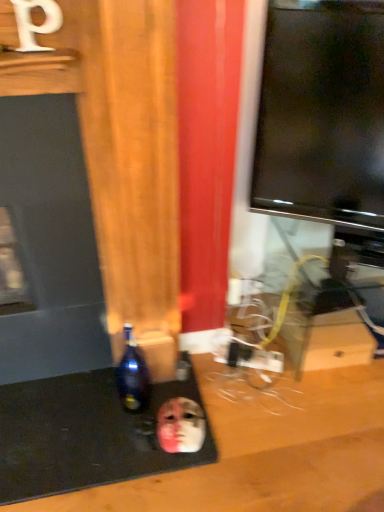
Question: Is the position of dark blue glass bottle at lower left more distant than that of smooth matte face at lower center?

Choices:
 (A) yes
 (B) no

Answer: (B)

Question: Is dark blue glass bottle at lower left facing towards smooth matte face at lower center?

Choices:
 (A) no
 (B) yes

Answer: (A)

Question: From the image's perspective, is dark blue glass bottle at lower left located beneath smooth matte face at lower center?

Choices:
 (A) yes
 (B) no

Answer: (B)

Question: Is dark blue glass bottle at lower left far from smooth matte face at lower center?

Choices:
 (A) yes
 (B) no

Answer: (B)

Question: Does dark blue glass bottle at lower left have a larger size compared to smooth matte face at lower center?

Choices:
 (A) yes
 (B) no

Answer: (A)

Question: Does dark blue glass bottle at lower left appear on the right side of smooth matte face at lower center?

Choices:
 (A) no
 (B) yes

Answer: (A)

Question: From a real-world perspective, is smooth matte face at lower center physically below dark blue glass bottle at lower left?

Choices:
 (A) no
 (B) yes

Answer: (B)

Question: Is smooth matte face at lower center at the left side of dark blue glass bottle at lower left?

Choices:
 (A) yes
 (B) no

Answer: (B)

Question: Is smooth matte face at lower center closer to the viewer compared to dark blue glass bottle at lower left?

Choices:
 (A) no
 (B) yes

Answer: (A)

Question: From the image's perspective, is smooth matte face at lower center located beneath dark blue glass bottle at lower left?

Choices:
 (A) yes
 (B) no

Answer: (A)

Question: Is smooth matte face at lower center behind dark blue glass bottle at lower left?

Choices:
 (A) no
 (B) yes

Answer: (B)

Question: Can you confirm if smooth matte face at lower center is wider than dark blue glass bottle at lower left?

Choices:
 (A) no
 (B) yes

Answer: (B)

Question: Is point (122, 369) positioned closer to the camera than point (178, 398)?

Choices:
 (A) farther
 (B) closer

Answer: (B)